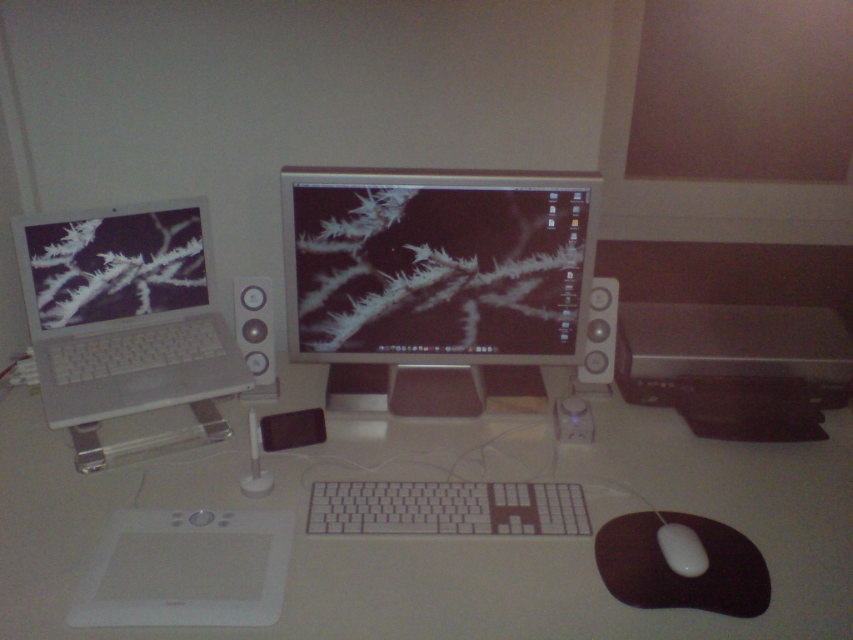
Question: In this image, where is white plastic computer desk at center located relative to silver metallic laptop at left?

Choices:
 (A) above
 (B) below

Answer: (B)

Question: Considering the real-world distances, which object is closest to the satin silver speaker at center?

Choices:
 (A) white matte mouse at lower right
 (B) white plastic keyboard at center
 (C) satin silver speaker at right
 (D) matte black monitor at center

Answer: (D)

Question: Considering the real-world distances, which object is farthest from the satin silver speaker at center?

Choices:
 (A) white plastic keyboard at center
 (B) white matte mouse at lower right
 (C) satin silver speaker at right
 (D) white plastic computer desk at center

Answer: (B)

Question: Which of the following is the farthest from the observer?

Choices:
 (A) (682, 568)
 (B) (223, 467)
 (C) (596, 388)

Answer: (C)

Question: Does matte black monitor at center appear on the right side of satin silver speaker at right?

Choices:
 (A) yes
 (B) no

Answer: (B)

Question: Does silver metallic laptop at left have a lesser width compared to satin silver speaker at center?

Choices:
 (A) yes
 (B) no

Answer: (B)